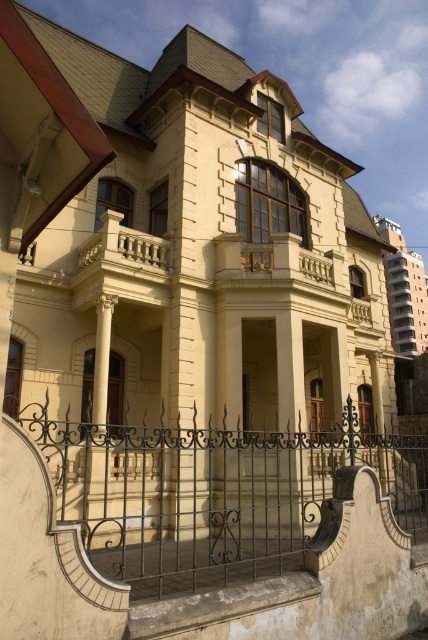
Question: Among these objects, which one is nearest to the camera?

Choices:
 (A) white glossy column at center
 (B) green wrought iron gate at lower center

Answer: (B)

Question: Does green wrought iron gate at lower center have a greater width compared to white glossy column at center?

Choices:
 (A) no
 (B) yes

Answer: (B)

Question: Which of the following is the farthest from the observer?

Choices:
 (A) (259, 481)
 (B) (100, 381)

Answer: (A)

Question: Is green wrought iron gate at lower center further to the viewer compared to white glossy column at center?

Choices:
 (A) no
 (B) yes

Answer: (A)

Question: Does green wrought iron gate at lower center have a larger size compared to white glossy column at center?

Choices:
 (A) yes
 (B) no

Answer: (A)